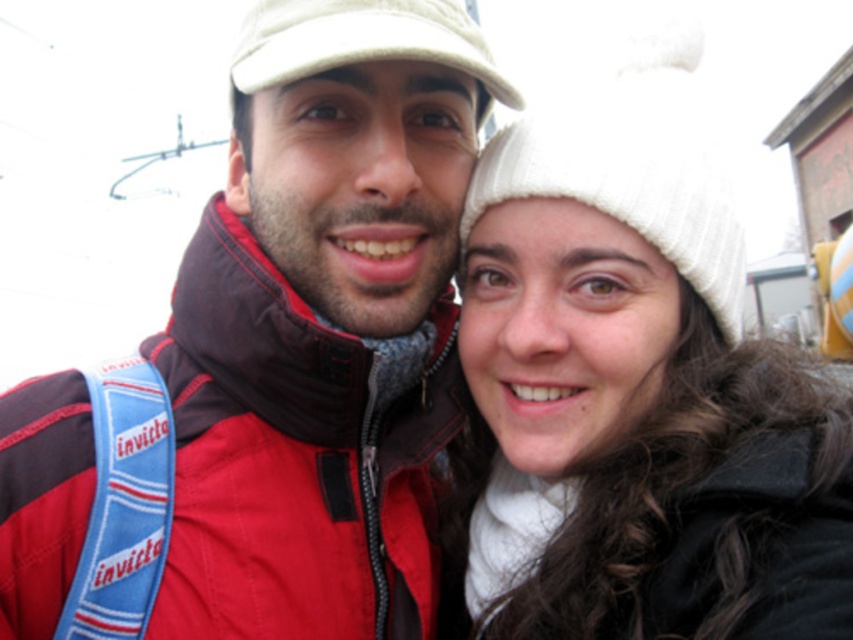
Looking at this image, you are a photographer trying to capture a clear shot of both the white knit hat at upper right and the white fabric cap at upper center. Which one is positioned lower in the frame?

The white knit hat at upper right is below the white fabric cap at upper center, so the white knit hat at upper right is positioned lower in the frame.

You are using a camera with a rectangular viewfinder. The red matte jacket at center is at coordinates point 0.722, 0.338. If the viewfinder has a width of 1 unit and height of 1 unit, what is the jacket positioned horizontally and vertically?

The red matte jacket at center is positioned at 72.2 percent horizontally from the left edge and 33.8 percent vertically from the bottom edge of the viewfinder.